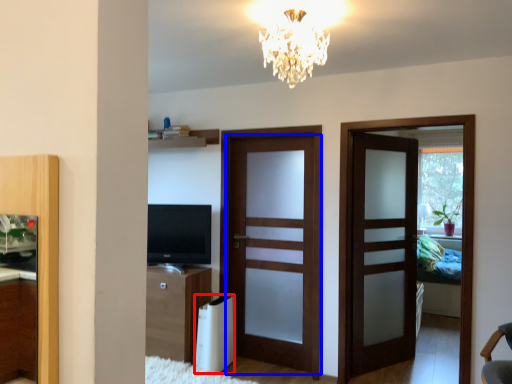
Question: Which object appears farthest to the camera in this image, appliance (highlighted by a red box) or door (highlighted by a blue box)?

Choices:
 (A) appliance
 (B) door

Answer: (B)